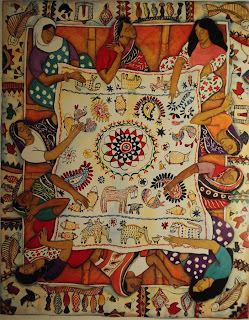
Where is `concentric geometric design in the middle of quilt`? Image resolution: width=249 pixels, height=320 pixels. concentric geometric design in the middle of quilt is located at coordinates (128, 149).